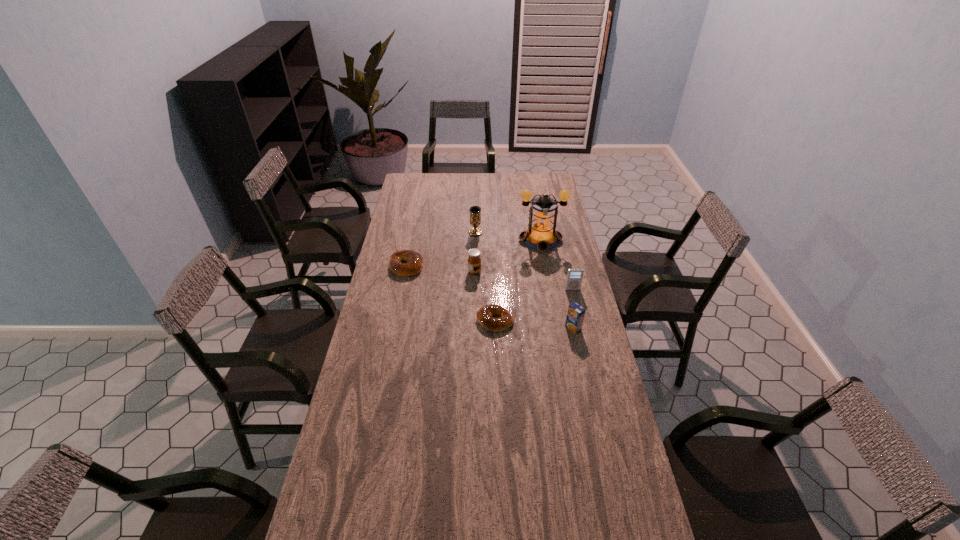
Observe the arrangement of all bagels in the image. To keep them evenly spaced, where would you place another bagel on the right? Please locate a free space. Please provide its 2D coordinates. Your answer should be formatted as a tuple, i.e. [(x, y)], where the tuple contains the x and y coordinates of a point satisfying the conditions above.

[(613, 394)]